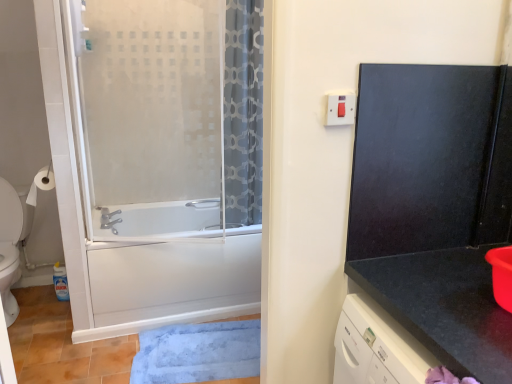
Find the location of a particular element. The height and width of the screenshot is (384, 512). free point below white glossy toilet at left (from a real-world perspective) is located at coordinates (26, 308).